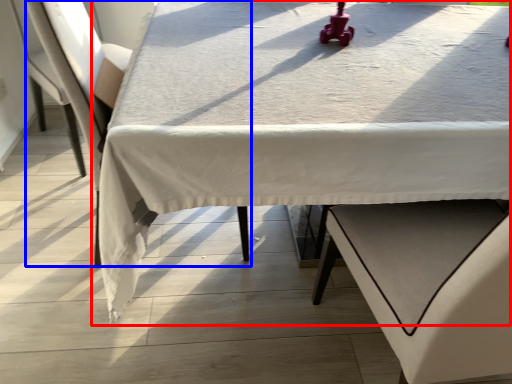
Question: Which object appears farthest to the camera in this image, table (highlighted by a red box) or armchair (highlighted by a blue box)?

Choices:
 (A) table
 (B) armchair

Answer: (B)